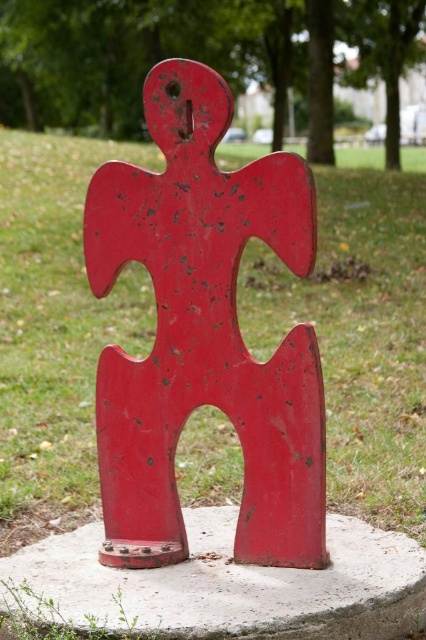
Question: Which point is closer to the camera taking this photo?

Choices:
 (A) (210, 518)
 (B) (365, 378)

Answer: (A)

Question: Is green grass at center positioned before concrete at center?

Choices:
 (A) yes
 (B) no

Answer: (B)

Question: Considering the relative positions of green grass at center and concrete at center in the image provided, where is green grass at center located with respect to concrete at center?

Choices:
 (A) above
 (B) below

Answer: (A)

Question: Is green grass at center to the left of concrete at center from the viewer's perspective?

Choices:
 (A) no
 (B) yes

Answer: (A)

Question: Which object is closer to the camera taking this photo?

Choices:
 (A) green grass at center
 (B) concrete at center

Answer: (B)